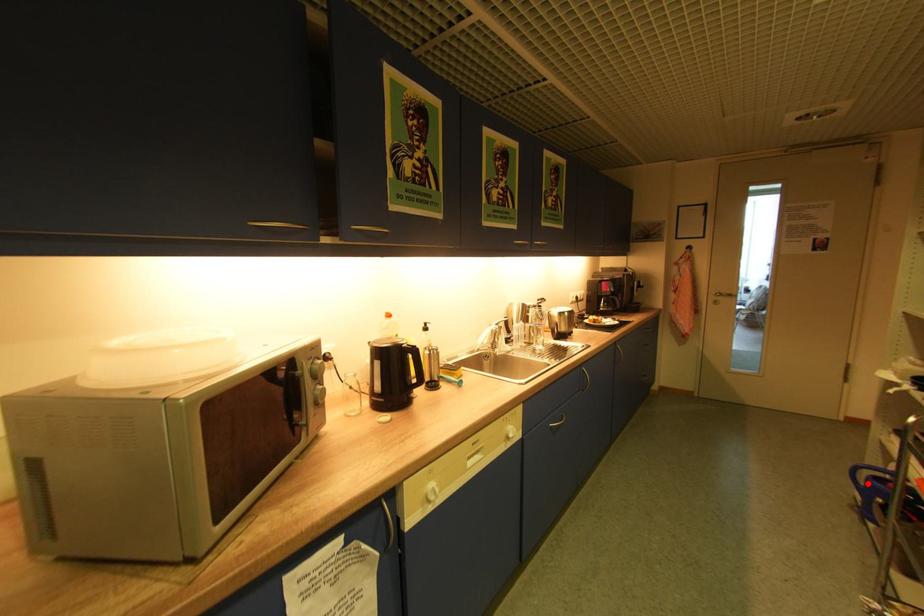
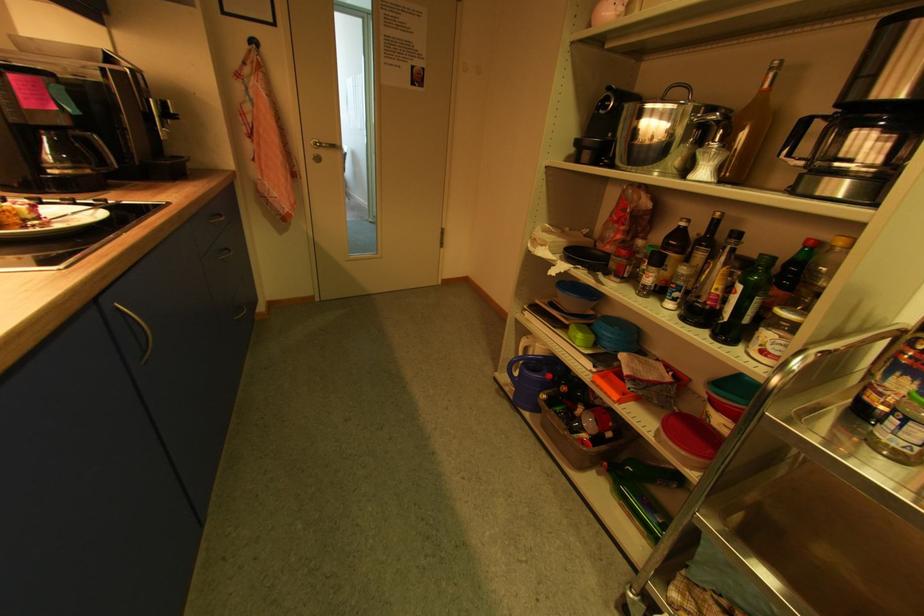
Find the pixel in the second image that matches the highlighted location in the first image.

(521, 375)